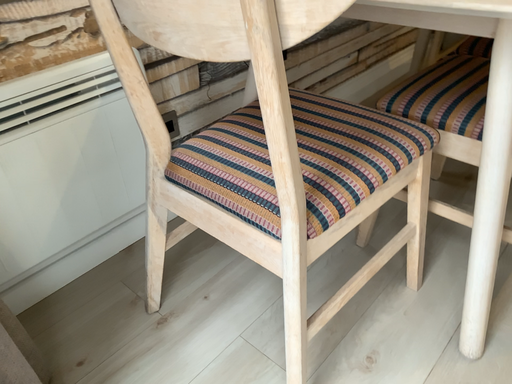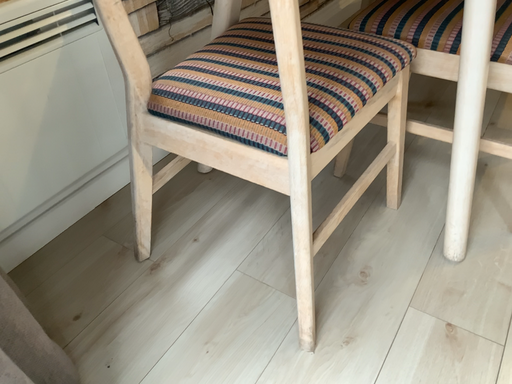
Question: How did the camera likely rotate when shooting the video?

Choices:
 (A) rotated right
 (B) rotated left

Answer: (A)